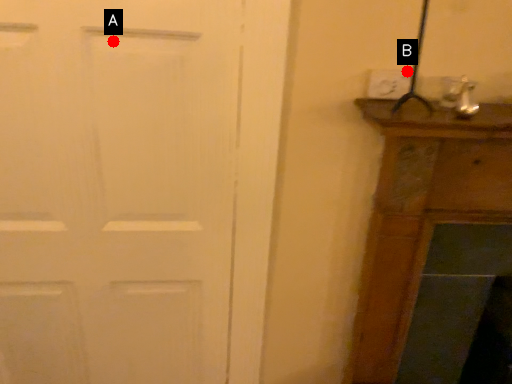
Question: Two points are circled on the image, labeled by A and B beside each circle. Which point is further to the camera?

Choices:
 (A) A is further
 (B) B is further

Answer: (B)